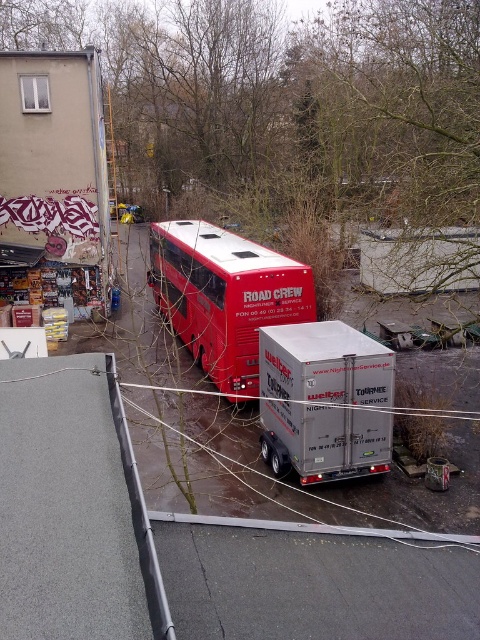
Question: Which object is closer to the camera taking this photo?

Choices:
 (A) shiny red bus at center
 (B) silver metallic trailer at center

Answer: (B)

Question: Observing the image, what is the correct spatial positioning of silver metallic trailer at center in reference to shiny red bus at center?

Choices:
 (A) below
 (B) above

Answer: (A)

Question: Can you confirm if silver metallic trailer at center is positioned below shiny red bus at center?

Choices:
 (A) yes
 (B) no

Answer: (A)

Question: In this image, where is silver metallic trailer at center located relative to shiny red bus at center?

Choices:
 (A) left
 (B) right

Answer: (B)